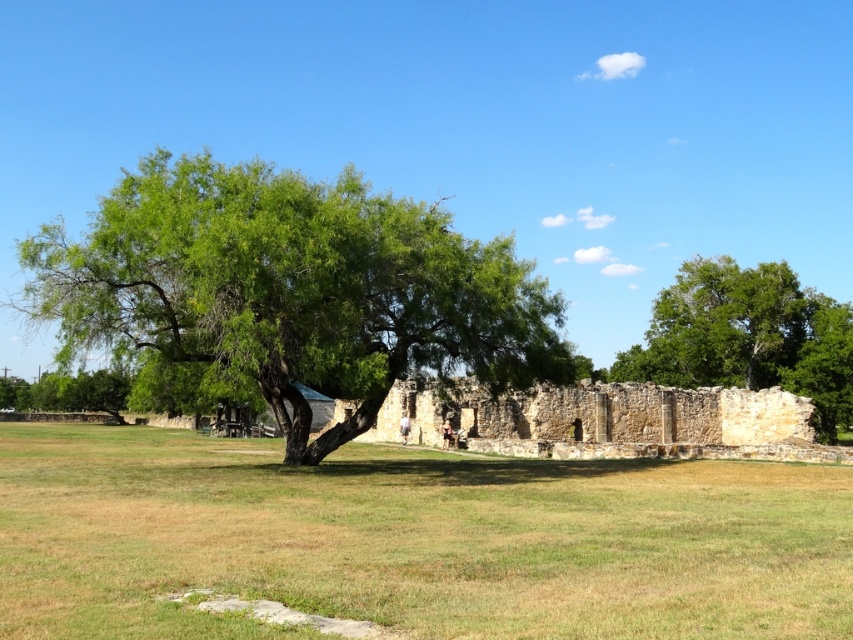
You are standing in the middle of a forest path and see both the green leafy tree at center and the green leafy tree at right. Which tree is closer to you?

The green leafy tree at center is closer to you because it is in front of the green leafy tree at right.